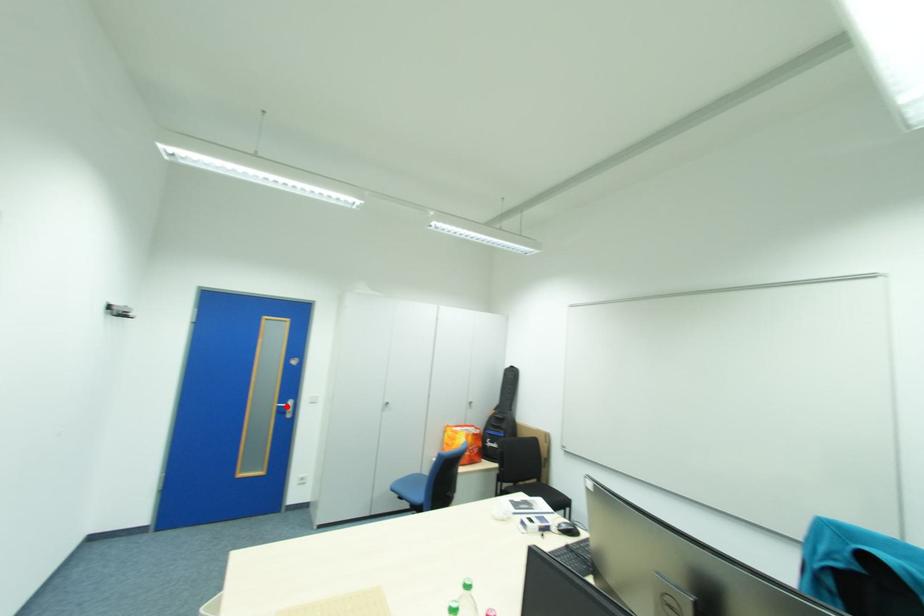
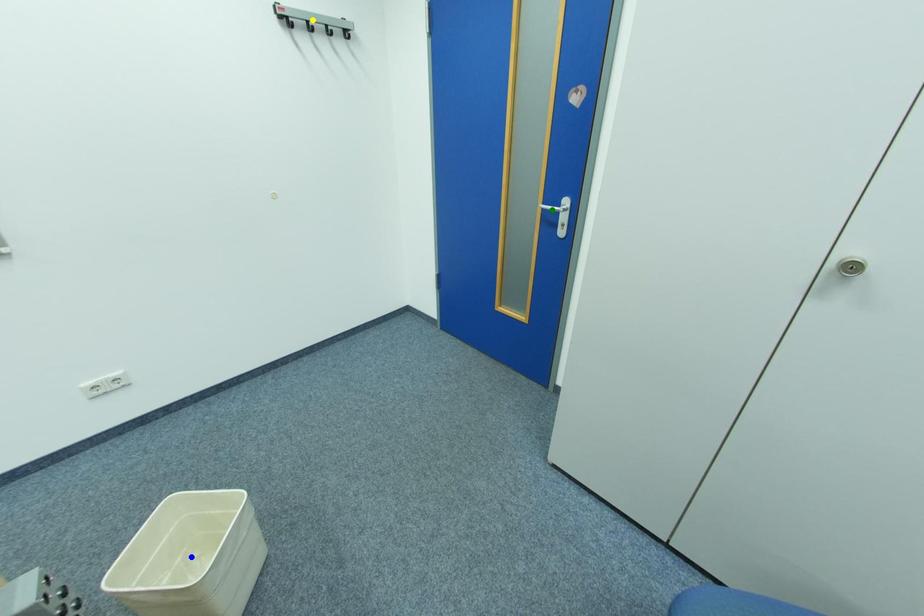
Question: I am providing you with two images of the same scene from different viewpoints. A red point is marked on the first image. You are given multiple points on the second image. Can you choose the point in image 2 that corresponds to the point in image 1?

Choices:
 (A) yellow point
 (B) green point
 (C) blue point

Answer: (B)